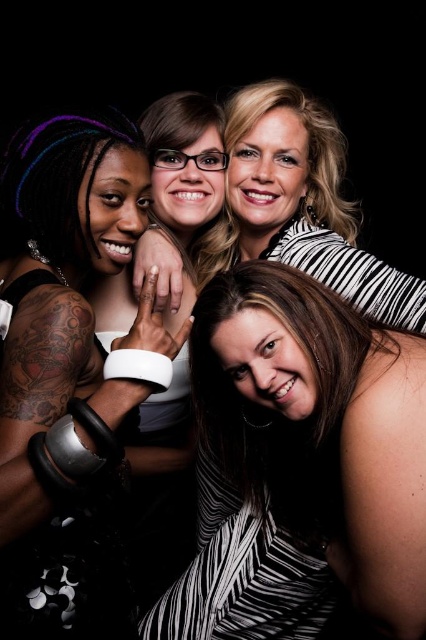
Can you confirm if striped fabric dress at lower right is smaller than matte black dress at left?

No, striped fabric dress at lower right is not smaller than matte black dress at left.

Does striped fabric dress at lower right have a lesser height compared to matte black dress at left?

Indeed, striped fabric dress at lower right has a lesser height compared to matte black dress at left.

Is point (379, 509) positioned after point (71, 461)?

Yes, it is.

The image size is (426, 640). Identify the location of striped fabric dress at lower right. (299, 465).